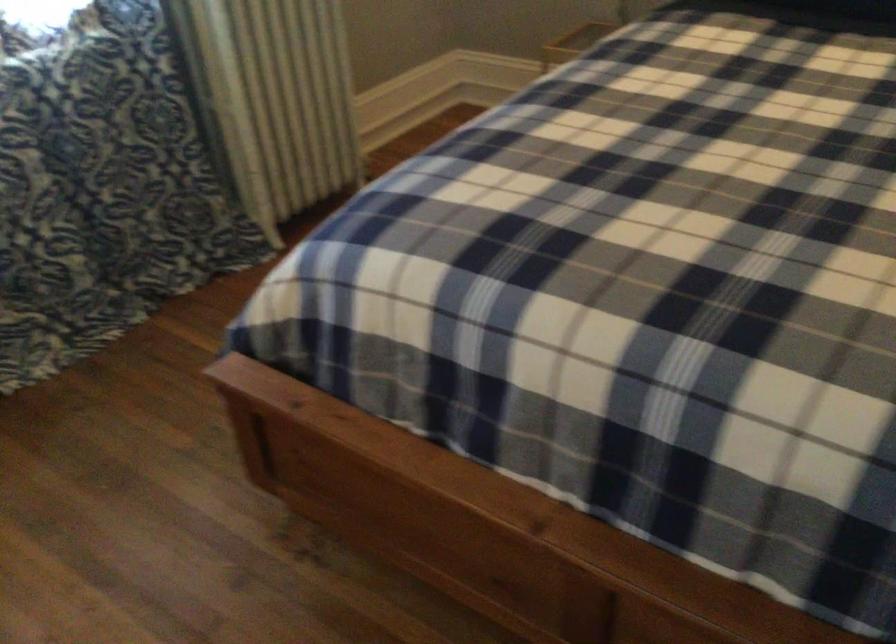
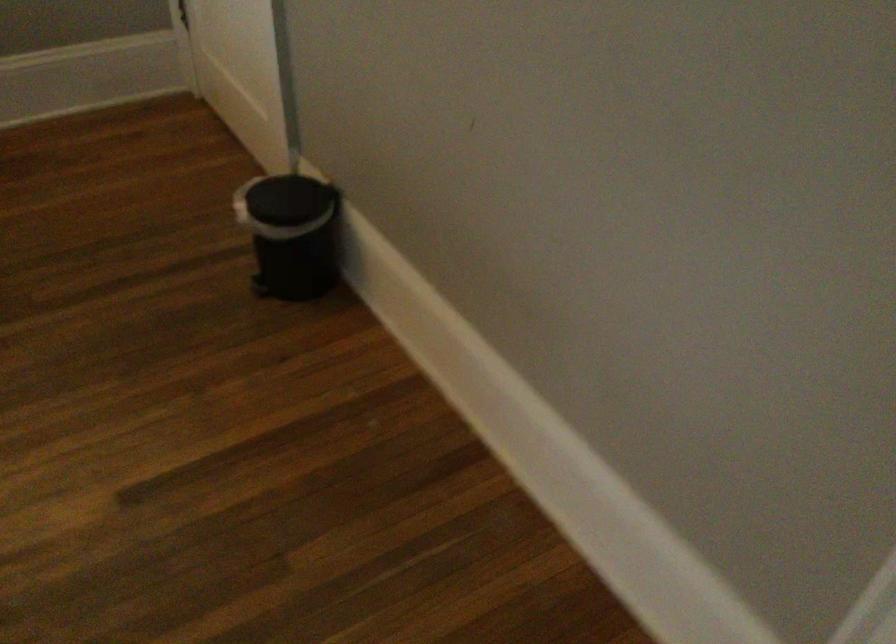
The images are taken continuously from a first-person perspective. In which direction is your viewpoint rotating?

The camera's rotation is toward right-down.